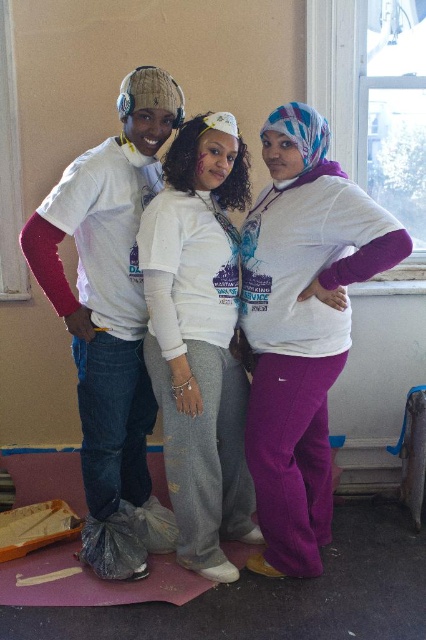
The image size is (426, 640). What are the coordinates of `purple fleece pants at center` in the screenshot? It's located at (302, 326).

Who is more distant from viewer, [319,208] or [166,547]?

Point [166,547]

In order to click on purple fleece pants at center in this screenshot , I will do `click(302, 326)`.

I want to click on purple fleece pants at center, so click(x=302, y=326).

Does purple fleece pants at center have a greater width compared to white soft sweatshirt at center?

Indeed, purple fleece pants at center has a greater width compared to white soft sweatshirt at center.

Can you confirm if purple fleece pants at center is bigger than white soft sweatshirt at center?

Indeed, purple fleece pants at center has a larger size compared to white soft sweatshirt at center.

Is point (247, 460) closer to camera compared to point (195, 168)?

No, it is not.

Find the location of a particular element. The image size is (426, 640). purple fleece pants at center is located at coordinates (302, 326).

Does white matte t-shirt at left appear over white soft sweatshirt at center?

Yes.

Which is behind, point (71, 204) or point (160, 259)?

Positioned behind is point (160, 259).

This screenshot has height=640, width=426. I want to click on white matte t-shirt at left, so click(x=109, y=305).

I want to click on white matte t-shirt at left, so click(109, 305).